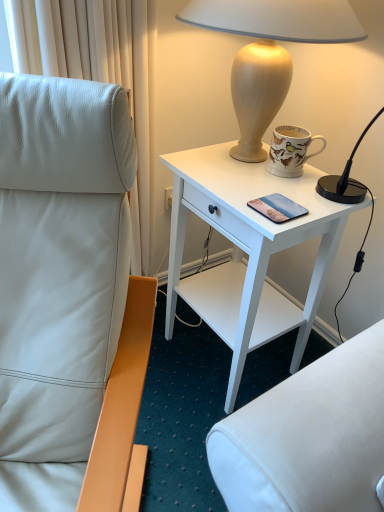
Question: From a real-world perspective, is matte glass mobile phone at center positioned over white wood desk at upper right based on gravity?

Choices:
 (A) no
 (B) yes

Answer: (B)

Question: Is matte glass mobile phone at center smaller than white wood desk at upper right?

Choices:
 (A) no
 (B) yes

Answer: (B)

Question: From the image's perspective, is matte glass mobile phone at center located above white wood desk at upper right?

Choices:
 (A) no
 (B) yes

Answer: (B)

Question: Is matte glass mobile phone at center to the left of white wood desk at upper right from the viewer's perspective?

Choices:
 (A) no
 (B) yes

Answer: (A)

Question: Is white wood desk at upper right a part of matte glass mobile phone at center?

Choices:
 (A) yes
 (B) no

Answer: (B)

Question: Looking at their shapes, would you say white leather chair at left is wider or thinner than white wood desk at upper right?

Choices:
 (A) wide
 (B) thin

Answer: (A)

Question: From the image's perspective, relative to white wood desk at upper right, is white leather chair at left above or below?

Choices:
 (A) below
 (B) above

Answer: (A)

Question: From a real-world perspective, relative to white wood desk at upper right, is white leather chair at left vertically above or below?

Choices:
 (A) below
 (B) above

Answer: (B)

Question: In terms of height, does white leather chair at left look taller or shorter compared to white wood desk at upper right?

Choices:
 (A) tall
 (B) short

Answer: (A)

Question: Based on their sizes in the image, would you say porcelain mug with bird illustrations at upper right is bigger or smaller than wooden lamp at upper right?

Choices:
 (A) small
 (B) big

Answer: (A)

Question: Considering the positions of porcelain mug with bird illustrations at upper right and wooden lamp at upper right in the image, is porcelain mug with bird illustrations at upper right taller or shorter than wooden lamp at upper right?

Choices:
 (A) tall
 (B) short

Answer: (B)

Question: Looking at their shapes, would you say porcelain mug with bird illustrations at upper right is wider or thinner than wooden lamp at upper right?

Choices:
 (A) wide
 (B) thin

Answer: (B)

Question: Considering their positions, is porcelain mug with bird illustrations at upper right located in front of or behind wooden lamp at upper right?

Choices:
 (A) behind
 (B) front

Answer: (A)

Question: Based on their positions, is matte glass mobile phone at center located to the left or right of porcelain mug with bird illustrations at upper right?

Choices:
 (A) right
 (B) left

Answer: (B)

Question: From the image's perspective, is matte glass mobile phone at center positioned above or below porcelain mug with bird illustrations at upper right?

Choices:
 (A) above
 (B) below

Answer: (B)